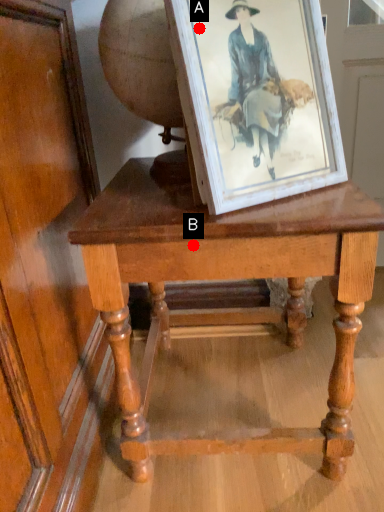
Question: Two points are circled on the image, labeled by A and B beside each circle. Which point is closer to the camera taking this photo?

Choices:
 (A) A is closer
 (B) B is closer

Answer: (A)